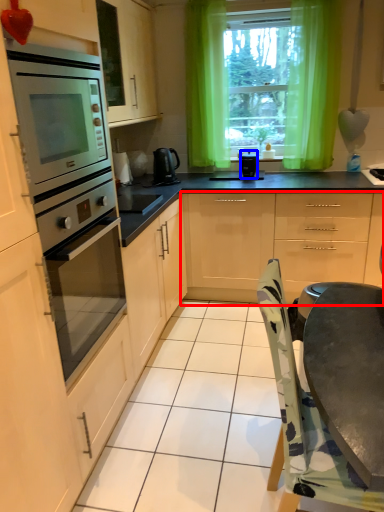
Question: Which object is further to the camera taking this photo, cabinetry (highlighted by a red box) or kitchen appliance (highlighted by a blue box)?

Choices:
 (A) cabinetry
 (B) kitchen appliance

Answer: (B)